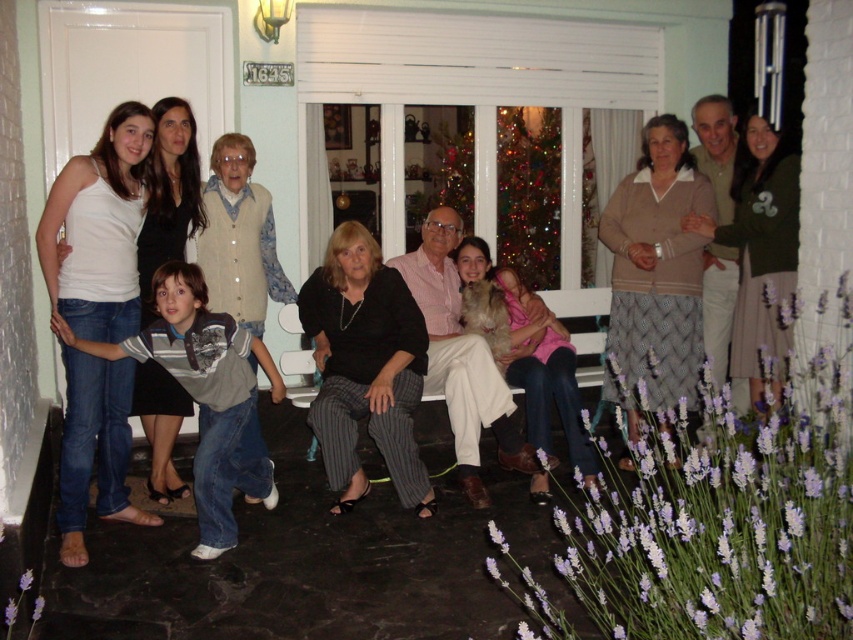
Does purple floral bush at lower right appear over jeans at left?

Incorrect, purple floral bush at lower right is not positioned above jeans at left.

Which is in front, point (805, 515) or point (190, 292)?

Point (805, 515) is more forward.

This screenshot has height=640, width=853. I want to click on purple floral bush at lower right, so click(723, 522).

Who is positioned more to the right, beige knit sweater at center or matte black sweater at center?

From the viewer's perspective, beige knit sweater at center appears more on the right side.

Is point (636, 372) closer to viewer compared to point (505, 276)?

Yes, it is.

Identify the location of beige knit sweater at center. (656, 273).

Can you confirm if jeans at left is bigger than light brown sweater at upper right?

Yes.

Which is behind, point (207, 500) or point (724, 332)?

Positioned behind is point (724, 332).

Does point (262, 349) come behind point (715, 340)?

No, it is not.

This screenshot has height=640, width=853. Identify the location of jeans at left. (206, 394).